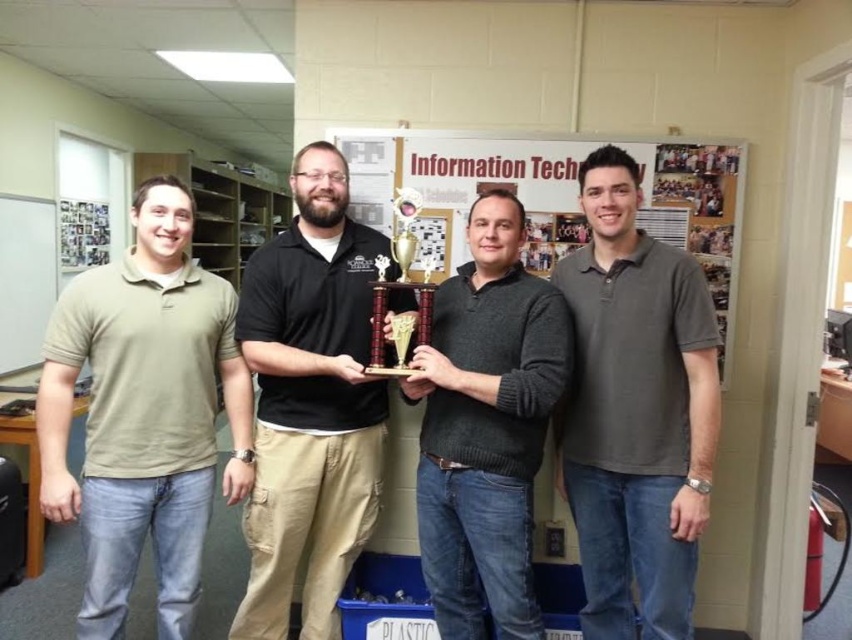
Between point (689, 433) and point (514, 349), which one is positioned in front?

Point (689, 433) is more forward.

Locate an element on the screen. dark gray polo shirt at right is located at coordinates (635, 410).

Does point (602, 396) come farther from viewer compared to point (458, 596)?

No, (602, 396) is closer to viewer.

Identify the location of dark gray polo shirt at right. (635, 410).

Does olive green polo shirt at left appear on the right side of black matte shirt at center?

In fact, olive green polo shirt at left is to the left of black matte shirt at center.

Who is more forward, (193,456) or (317,337)?

Point (193,456)

This screenshot has height=640, width=852. What do you see at coordinates (144, 413) in the screenshot? I see `olive green polo shirt at left` at bounding box center [144, 413].

The width and height of the screenshot is (852, 640). Identify the location of olive green polo shirt at left. (144, 413).

From the picture: Does olive green polo shirt at left have a greater height compared to dark gray polo shirt at right?

In fact, olive green polo shirt at left may be shorter than dark gray polo shirt at right.

Between olive green polo shirt at left and dark gray polo shirt at right, which one appears on the left side from the viewer's perspective?

olive green polo shirt at left

The width and height of the screenshot is (852, 640). I want to click on olive green polo shirt at left, so click(x=144, y=413).